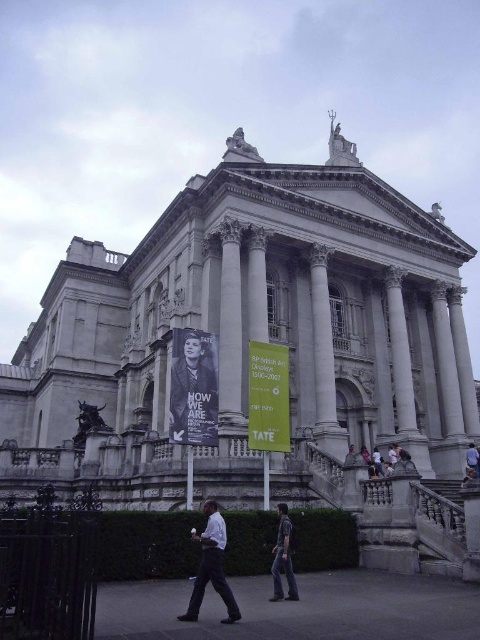
What object is located at the coordinates point (193, 388)?

The point (193, 388) corresponds to the black paper poster at center.

You are standing in front of the grand neoclassical building and notice two banners at the center. The banners are labeled as the black paper poster at center and the yellow paper poster at center. Which banner is taller?

The black paper poster at center is much taller than the yellow paper poster at center.

You are a visitor standing in front of the grand neoclassical building and see both the black paper poster at center and the yellow paper poster at center. Which poster is bigger?

The black paper poster at center is larger than the yellow paper poster at center.